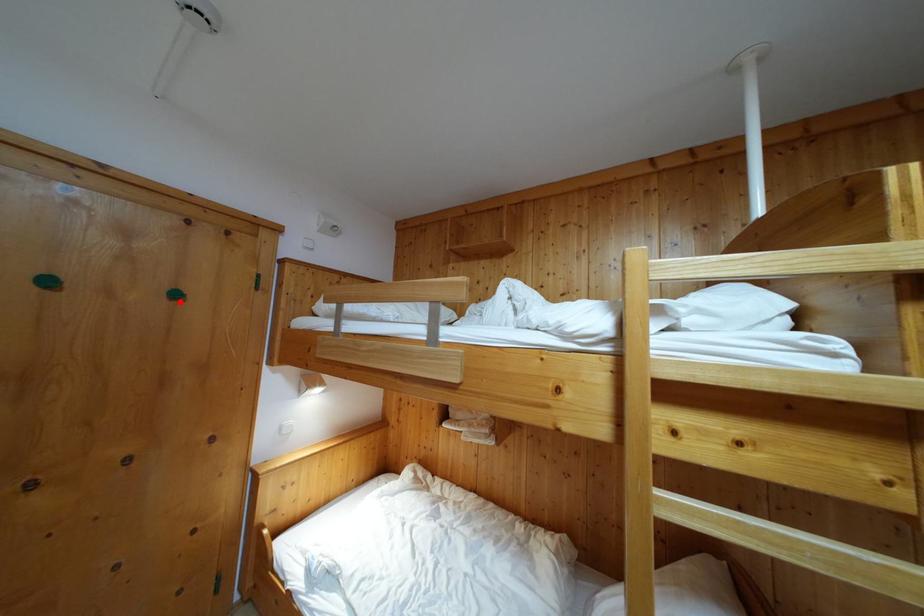
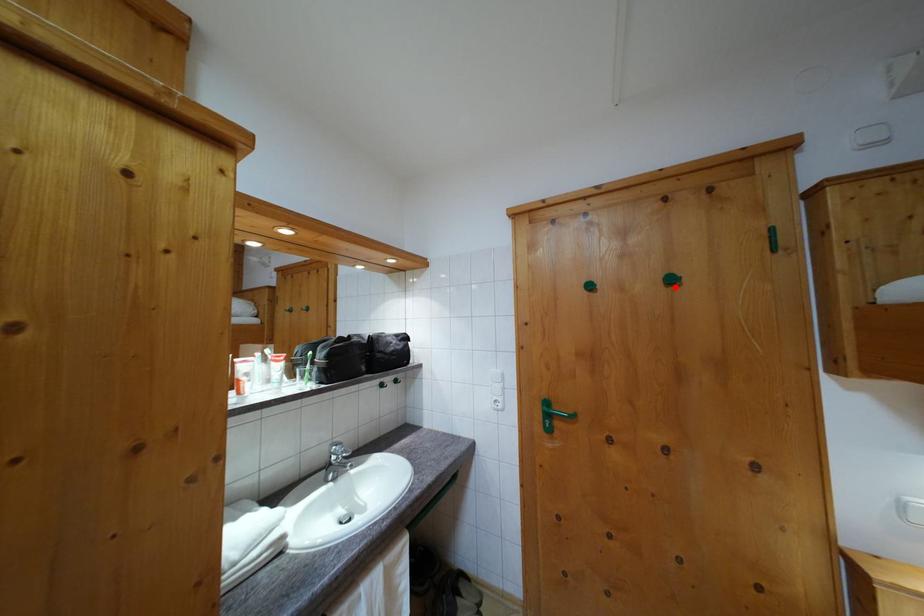
I am providing you with two images of the same scene from different viewpoints. A red point is marked on the first image and another point is marked on the second image. Is the marked point in image1 the same physical position as the marked point in image2?

Result: Yes